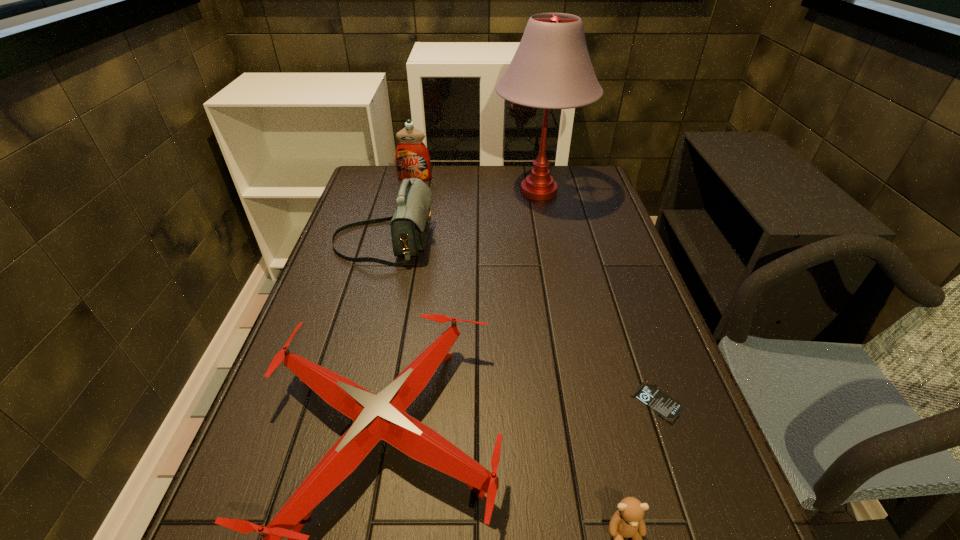
Where is `vacant area located 0.370m on the left of the identity card`? vacant area located 0.370m on the left of the identity card is located at coordinates (445, 401).

Where is `table lamp that is at the far edge`? The width and height of the screenshot is (960, 540). table lamp that is at the far edge is located at coordinates (551, 69).

Find the location of a particular element. This screenshot has width=960, height=540. detergent that is at the far edge is located at coordinates (412, 158).

I want to click on detergent at the left edge, so click(x=412, y=158).

At what (x,y) coordinates should I click in order to perform the action: click on shoulder bag that is at the left edge. Please return your answer as a coordinate pair (x, y). This screenshot has width=960, height=540. Looking at the image, I should click on (410, 223).

Image resolution: width=960 pixels, height=540 pixels. I want to click on table lamp present at the right edge, so (x=551, y=69).

At what (x,y) coordinates should I click in order to perform the action: click on identity card that is at the right edge. Please return your answer as a coordinate pair (x, y). Image resolution: width=960 pixels, height=540 pixels. Looking at the image, I should click on (667, 408).

Locate an element on the screen. This screenshot has width=960, height=540. object that is at the far left corner is located at coordinates (412, 158).

You are a GUI agent. You are given a task and a screenshot of the screen. Output one action in this format:
    pyautogui.click(x=<x>, y=<y>)
    Task: Click on the object positioned at the far right corner
    
    Given the screenshot: What is the action you would take?
    pyautogui.click(x=551, y=69)

Where is `vacant area at the far edge`? The image size is (960, 540). vacant area at the far edge is located at coordinates (478, 191).